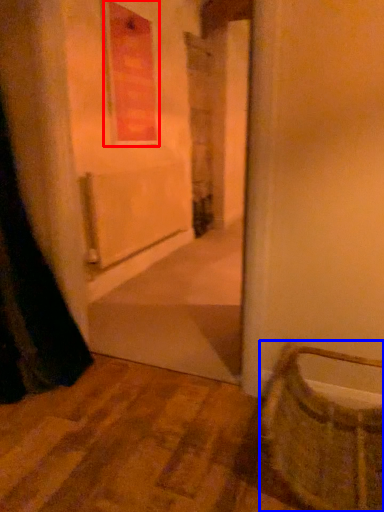
Question: Among these objects, which one is nearest to the camera, window (highlighted by a red box) or basket (highlighted by a blue box)?

Choices:
 (A) window
 (B) basket

Answer: (B)